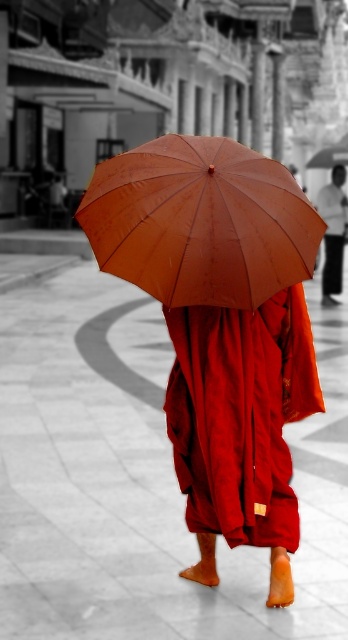
You are standing at the camera position and want to walk towards the matte orange umbrella at center. How many steps would you need to take to reach it if each step covers 2.5 feet?

The distance between the matte orange umbrella at center and the camera is 14.55 feet. Since each step covers 2.5 feet, dividing 14.55 by 2.5 gives approximately 5.82 steps. Therefore, you would need to take 6 steps to reach the matte orange umbrella at center.

You are standing in the temple area and want to walk towards the person in red robes holding the umbrella. Which point, point (198, 342) or point (335, 220), should you aim for to reach the person?

You should aim for point (198, 342) because it is in front of point (335, 220), meaning it is closer to the person in red robes holding the umbrella.

You are a photographer trying to capture the scene. You need to adjust your camera focus to ensure both the matte orange umbrella at center and the smooth skin head at upper center are in focus. Based on their positions, which object should you focus on first to ensure both are sharp?

The matte orange umbrella at center is located below the smooth skin head at upper center. To ensure both are in focus, you should focus on the smooth skin head at upper center first, as it is closer to the camera, and the umbrella will naturally fall into focus due to its position below.